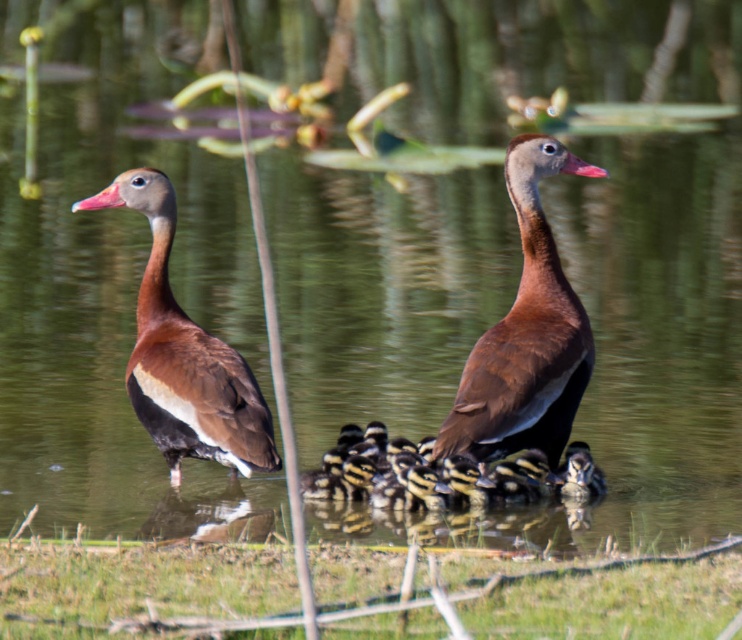
Question: Is brown matte duck at center above brown matte duck at left?

Choices:
 (A) no
 (B) yes

Answer: (B)

Question: Which of the following is the closest to the observer?

Choices:
 (A) yellow-black striped ducklings at center
 (B) brown glossy duckling at center

Answer: (A)

Question: Where is brown matte duck at center located in relation to yellow-black striped ducklings at center in the image?

Choices:
 (A) left
 (B) right

Answer: (B)

Question: Which point appears closest to the camera in this image?

Choices:
 (A) (600, 481)
 (B) (160, 243)

Answer: (B)

Question: Is brown matte duck at left below yellow-black striped ducklings at center?

Choices:
 (A) yes
 (B) no

Answer: (B)

Question: Which object appears farthest from the camera in this image?

Choices:
 (A) brown matte duck at left
 (B) green grass at lower center
 (C) brown matte duck at center

Answer: (C)